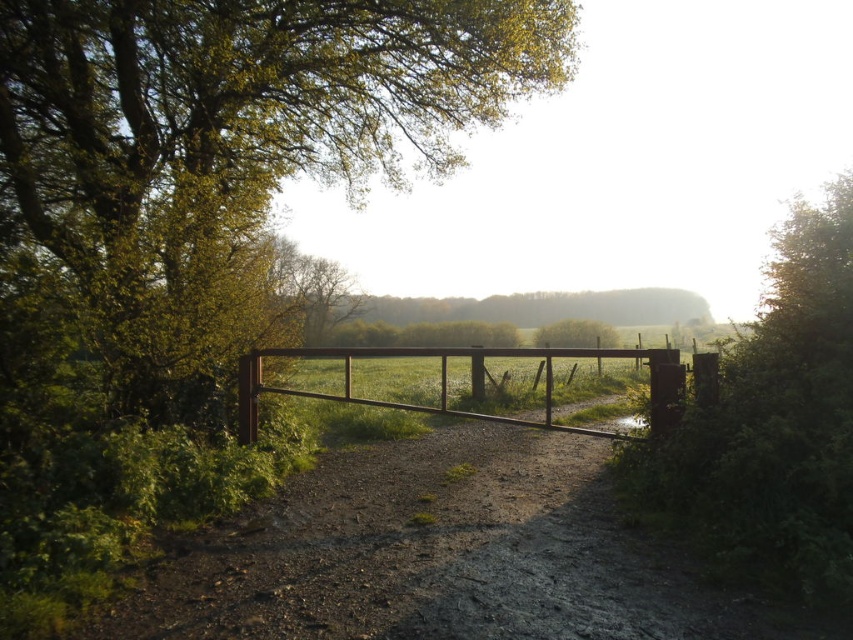
You are a hiker standing at the start of the dirt path and see the green leafy tree at center and the brown wooden gate at center. Which object is closer to you?

The green leafy tree at center is closer to you because the brown wooden gate at center is behind it.

You are standing at the entrance of the wooden gate and want to walk directly towards the green leafy tree at center. In which direction should you head?

The green leafy tree at center is located at point (231, 134), so you should head towards the center of the image to reach it.

You are a gardener planning to plant a new tree in the field. You want to ensure the new tree won not block the view of the brown wooden gate at center from the green leafy tree at center. Given their current widths, is this possible?

The green leafy tree at center is narrower than the brown wooden gate at center, so planting a new tree might block the view if placed between them. To maintain the view, ensure the new tree is planted outside the line of sight between the two existing objects.